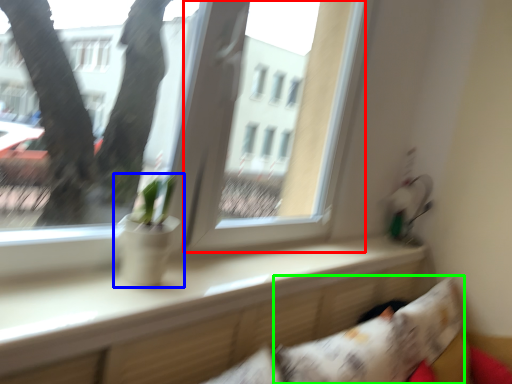
Question: Which object is positioned farthest from window screen (highlighted by a red box)? Select from houseplant (highlighted by a blue box) and pillow (highlighted by a green box).

Choices:
 (A) houseplant
 (B) pillow

Answer: (B)